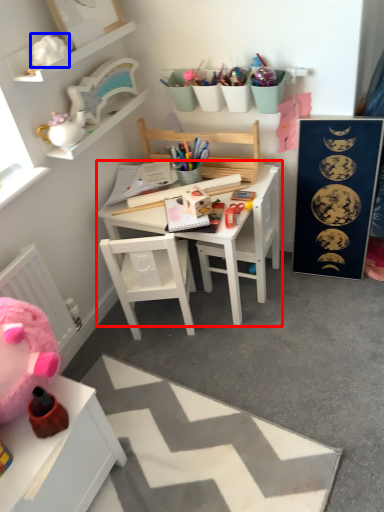
Question: Which object is closer to the camera taking this photo, table (highlighted by a red box) or toy (highlighted by a blue box)?

Choices:
 (A) table
 (B) toy

Answer: (B)